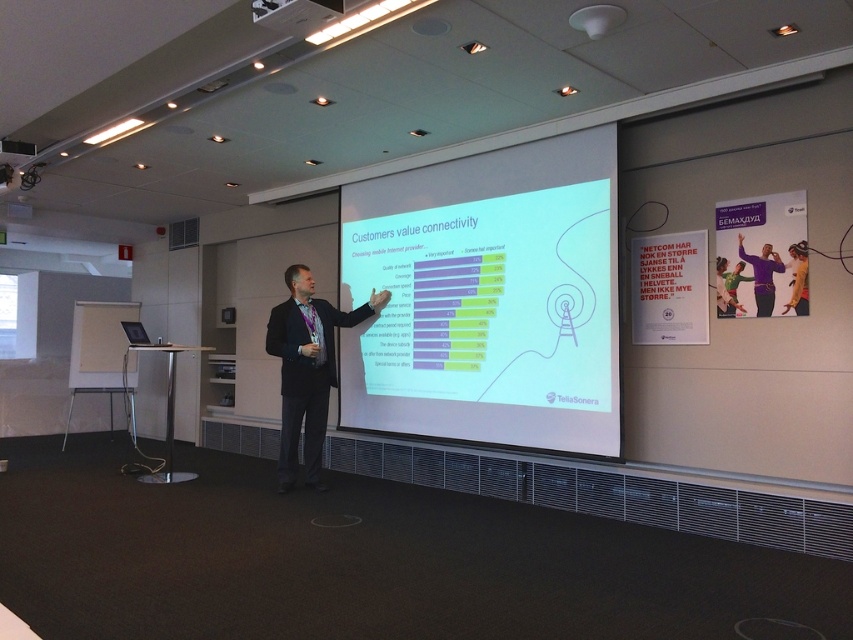
Question: Considering the real-world distances, which object is farthest from the black suit at center?

Choices:
 (A) matte white projector screen at center
 (B) white plastic projector at upper center

Answer: (B)

Question: Is matte white projector screen at center bigger than white plastic projector at upper center?

Choices:
 (A) no
 (B) yes

Answer: (B)

Question: Observing the image, what is the correct spatial positioning of matte white projector screen at center in reference to black suit at center?

Choices:
 (A) below
 (B) above

Answer: (B)

Question: Does matte white projector screen at center appear under white plastic projector at upper center?

Choices:
 (A) yes
 (B) no

Answer: (A)

Question: Which of the following is the farthest from the observer?

Choices:
 (A) (424, 259)
 (B) (270, 20)

Answer: (A)

Question: Among these objects, which one is farthest from the camera?

Choices:
 (A) matte white projector screen at center
 (B) black suit at center

Answer: (B)